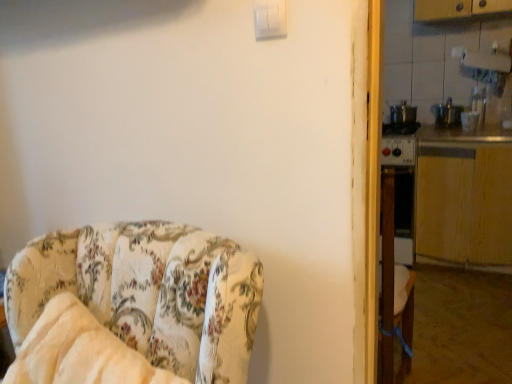
Question: Is metallic silver counter top at right, which ranks as the second counter top in bottom-to-top order, positioned before white plastic light switch at upper center?

Choices:
 (A) yes
 (B) no

Answer: (B)

Question: Considering the relative sizes of metallic silver counter top at right, which appears as the first counter top when viewed from the top, and white plastic light switch at upper center in the image provided, is metallic silver counter top at right, which appears as the first counter top when viewed from the top, smaller than white plastic light switch at upper center?

Choices:
 (A) yes
 (B) no

Answer: (B)

Question: Considering the relative positions of metallic silver counter top at right, which ranks as the second counter top in bottom-to-top order, and white plastic light switch at upper center in the image provided, is metallic silver counter top at right, which ranks as the second counter top in bottom-to-top order, to the left of white plastic light switch at upper center from the viewer's perspective?

Choices:
 (A) no
 (B) yes

Answer: (A)

Question: Does metallic silver counter top at right, which appears as the first counter top when viewed from the top, have a lesser width compared to white plastic light switch at upper center?

Choices:
 (A) no
 (B) yes

Answer: (A)

Question: Can you confirm if metallic silver counter top at right, which ranks as the second counter top in bottom-to-top order, is bigger than white plastic light switch at upper center?

Choices:
 (A) no
 (B) yes

Answer: (B)

Question: Does metallic silver counter top at right, which appears as the first counter top when viewed from the top, appear on the right side of white plastic light switch at upper center?

Choices:
 (A) yes
 (B) no

Answer: (A)

Question: Is metallic silver counter top at right, which ranks as the second counter top in bottom-to-top order, at the back of wooden at right, placed as the 2th counter top when sorted from top to bottom?

Choices:
 (A) yes
 (B) no

Answer: (B)

Question: From the image's perspective, is wooden at right, placed as the 2th counter top when sorted from top to bottom, located above metallic silver counter top at right, which appears as the first counter top when viewed from the top?

Choices:
 (A) yes
 (B) no

Answer: (B)

Question: Considering the relative sizes of wooden at right, placed as the 2th counter top when sorted from top to bottom, and metallic silver counter top at right, which appears as the first counter top when viewed from the top, in the image provided, is wooden at right, placed as the 2th counter top when sorted from top to bottom, shorter than metallic silver counter top at right, which appears as the first counter top when viewed from the top,?

Choices:
 (A) yes
 (B) no

Answer: (B)

Question: Does wooden at right, placed as the 2th counter top when sorted from top to bottom, have a smaller size compared to metallic silver counter top at right, which ranks as the second counter top in bottom-to-top order?

Choices:
 (A) yes
 (B) no

Answer: (B)

Question: Is the position of wooden at right, placed as the 2th counter top when sorted from top to bottom, less distant than that of metallic silver counter top at right, which ranks as the second counter top in bottom-to-top order?

Choices:
 (A) no
 (B) yes

Answer: (B)

Question: Is wooden at right, placed as the 2th counter top when sorted from top to bottom, thinner than metallic silver counter top at right, which appears as the first counter top when viewed from the top?

Choices:
 (A) yes
 (B) no

Answer: (B)

Question: From a real-world perspective, is floral fabric chair at left over metallic silver counter top at right, which ranks as the second counter top in bottom-to-top order?

Choices:
 (A) no
 (B) yes

Answer: (A)